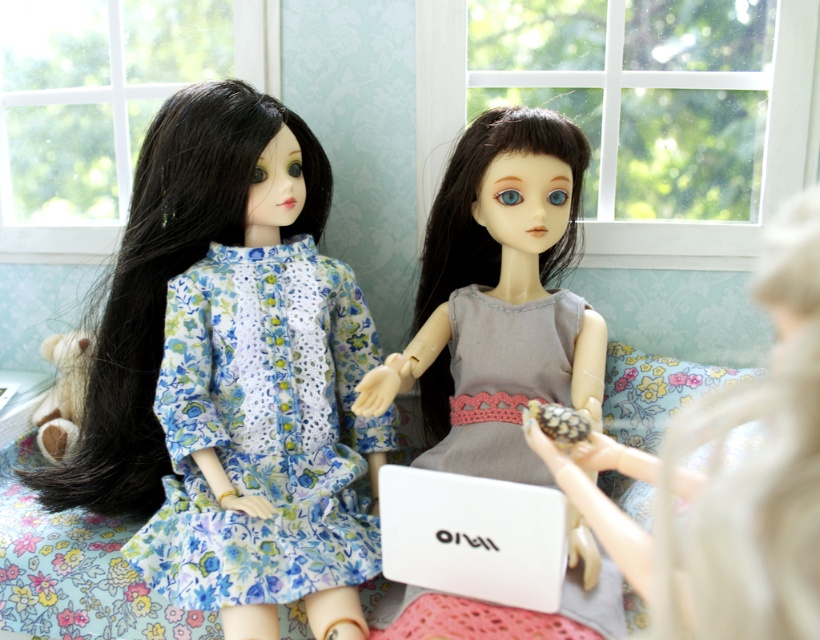
Question: Can you confirm if floral fabric dress at left is thinner than floral cotton dress at left?

Choices:
 (A) no
 (B) yes

Answer: (A)

Question: Is floral fabric dress at left positioned at the back of matte gray dress at center?

Choices:
 (A) no
 (B) yes

Answer: (B)

Question: Does matte gray dress at center have a greater width compared to gray crochet dress at center?

Choices:
 (A) yes
 (B) no

Answer: (A)

Question: Among these points, which one is farthest from the camera?

Choices:
 (A) (139, 412)
 (B) (727, 538)
 (C) (536, 461)

Answer: (A)

Question: Which of the following is the closest to the observer?

Choices:
 (A) (185, 545)
 (B) (156, 380)
 (C) (565, 616)
 (D) (800, 524)

Answer: (D)

Question: Which of the following is the farthest from the observer?

Choices:
 (A) floral cotton dress at left
 (B) floral fabric dress at left
 (C) matte gray dress at center

Answer: (A)